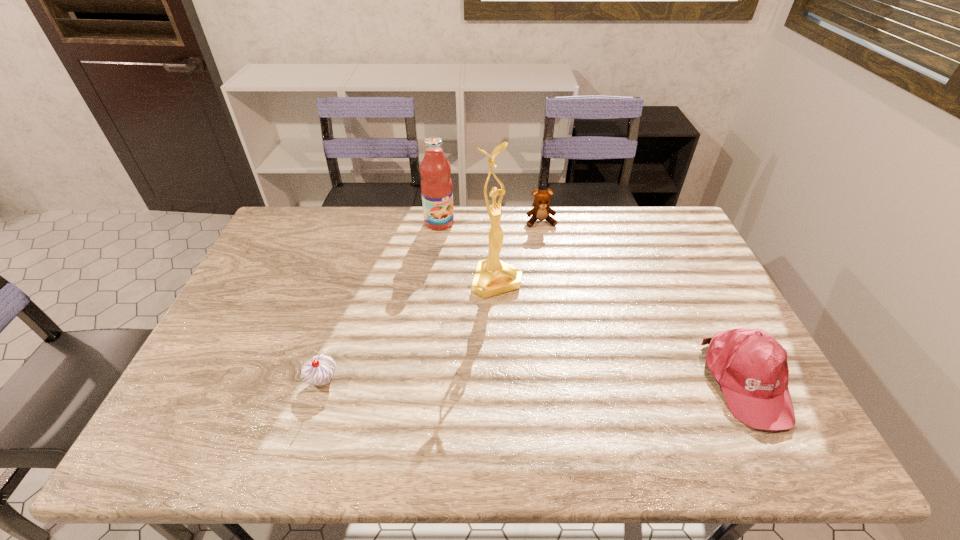
Identify the location of the leftmost object. The height and width of the screenshot is (540, 960). (318, 371).

Where is `baseball cap`? The width and height of the screenshot is (960, 540). baseball cap is located at coordinates (751, 367).

The height and width of the screenshot is (540, 960). In order to click on award in this screenshot , I will do `click(492, 277)`.

This screenshot has height=540, width=960. Find the location of `the tallest object`. the tallest object is located at coordinates (492, 277).

The height and width of the screenshot is (540, 960). I want to click on the second tallest object, so click(436, 186).

Find the location of a particular element. The width and height of the screenshot is (960, 540). the second object from left to right is located at coordinates (436, 186).

Identify the location of teddy bear. (541, 210).

At what (x,y) coordinates should I click in order to perform the action: click on free space located 0.370m on the right of the cupcake. Please return your answer as a coordinate pair (x, y). Looking at the image, I should click on (488, 381).

The image size is (960, 540). I want to click on vacant space situated on the front-facing side of the tallest object, so click(x=584, y=403).

The height and width of the screenshot is (540, 960). I want to click on vacant region located 0.110m on the front-facing side of the tallest object, so [526, 322].